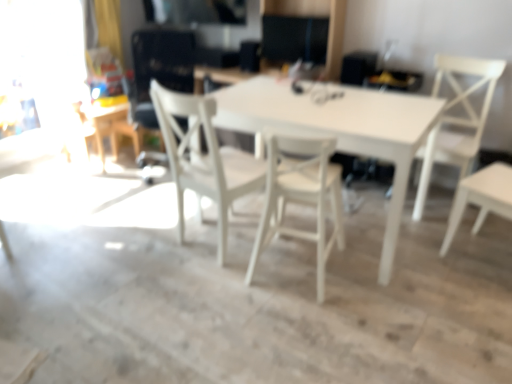
Question: Is white matte table at upper left, which ranks as the 1th table in back-to-front order, looking in the opposite direction of white wood chair at center, which ranks as the 1th chair in left-to-right order?

Choices:
 (A) no
 (B) yes

Answer: (A)

Question: Considering the relative sizes of white matte table at upper left, positioned as the 2th table in front-to-back order, and white wood chair at center, placed as the 3th chair when sorted from right to left, in the image provided, is white matte table at upper left, positioned as the 2th table in front-to-back order, taller than white wood chair at center, placed as the 3th chair when sorted from right to left,?

Choices:
 (A) yes
 (B) no

Answer: (B)

Question: Does white matte table at upper left, positioned as the 2th table in front-to-back order, have a lesser width compared to white wood chair at center, which ranks as the 1th chair in left-to-right order?

Choices:
 (A) yes
 (B) no

Answer: (A)

Question: Does white matte table at upper left, positioned as the 2th table in front-to-back order, appear on the right side of white wood chair at center, placed as the 3th chair when sorted from right to left?

Choices:
 (A) yes
 (B) no

Answer: (B)

Question: Could white wood chair at center, placed as the 3th chair when sorted from right to left, be considered to be inside white matte table at upper left, the 1th table positioned from the left?

Choices:
 (A) no
 (B) yes

Answer: (A)

Question: Is white matte table at upper left, which ranks as the 1th table in back-to-front order, taller or shorter than white matte table at center, positioned as the first table in right-to-left order?

Choices:
 (A) tall
 (B) short

Answer: (B)

Question: Considering the positions of white matte table at upper left, which ranks as the 1th table in back-to-front order, and white matte table at center, the 2th table from the back, in the image, is white matte table at upper left, which ranks as the 1th table in back-to-front order, bigger or smaller than white matte table at center, the 2th table from the back,?

Choices:
 (A) big
 (B) small

Answer: (B)

Question: In terms of width, does white matte table at upper left, positioned as the 2th table in front-to-back order, look wider or thinner when compared to white matte table at center, the 2th table from the back?

Choices:
 (A) thin
 (B) wide

Answer: (A)

Question: Does point (122, 110) appear closer or farther from the camera than point (298, 127)?

Choices:
 (A) farther
 (B) closer

Answer: (A)

Question: From a real-world perspective, is white wood chair at center, which ranks as the 1th chair in left-to-right order, positioned above or below white matte table at upper left, positioned as the 2th table in front-to-back order?

Choices:
 (A) above
 (B) below

Answer: (A)

Question: From the image's perspective, relative to white matte table at upper left, positioned as the 2th table in front-to-back order, is white wood chair at center, which ranks as the 1th chair in left-to-right order, above or below?

Choices:
 (A) above
 (B) below

Answer: (B)

Question: Considering the positions of white wood chair at center, which ranks as the 1th chair in left-to-right order, and white matte table at upper left, which ranks as the 1th table in back-to-front order, in the image, is white wood chair at center, which ranks as the 1th chair in left-to-right order, taller or shorter than white matte table at upper left, which ranks as the 1th table in back-to-front order,?

Choices:
 (A) tall
 (B) short

Answer: (A)

Question: Looking at their shapes, would you say white wood chair at center, placed as the 3th chair when sorted from right to left, is wider or thinner than white matte table at upper left, the 1th table positioned from the left?

Choices:
 (A) wide
 (B) thin

Answer: (A)

Question: From the image's perspective, is white matte table at center, the 2th table from the back, located above or below white matte chair at right, arranged as the third chair when viewed from the left?

Choices:
 (A) below
 (B) above

Answer: (A)

Question: In the image, is white matte table at center, marked as the second table in a left-to-right arrangement, on the left side or the right side of white matte chair at right, acting as the first chair starting from the right?

Choices:
 (A) right
 (B) left

Answer: (B)